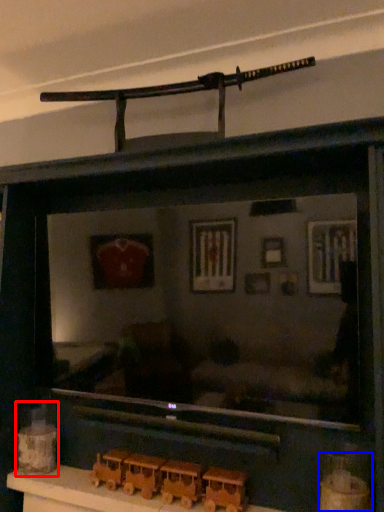
Question: Which of the following is the farthest to the observer, toy (highlighted by a red box) or toy (highlighted by a blue box)?

Choices:
 (A) toy
 (B) toy

Answer: (A)